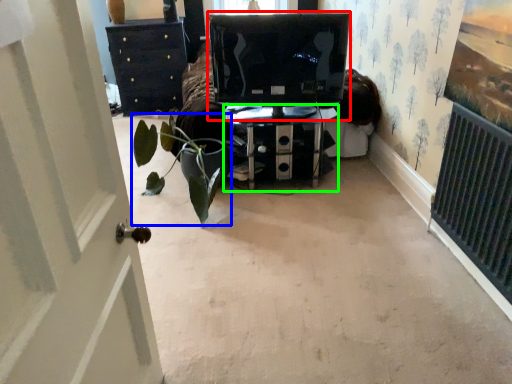
Question: Which is nearer to the computer monitor (highlighted by a red box)? houseplant (highlighted by a blue box) or furniture (highlighted by a green box).

Choices:
 (A) houseplant
 (B) furniture

Answer: (B)